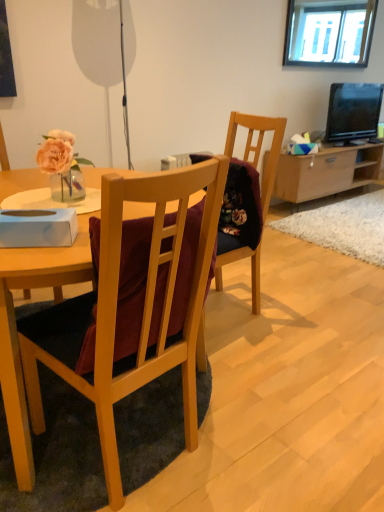
Identify the location of free location to the right of wooden chair at center. (271, 454).